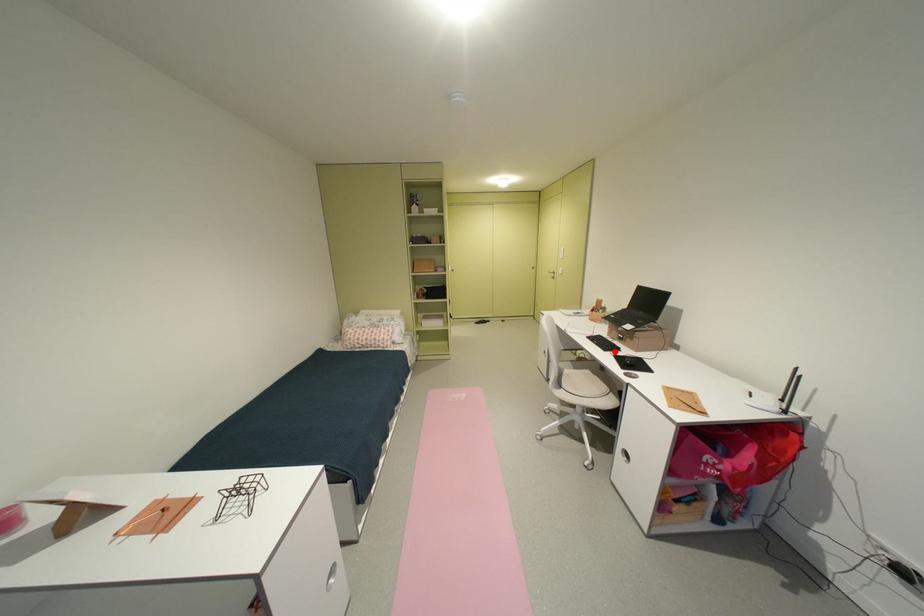
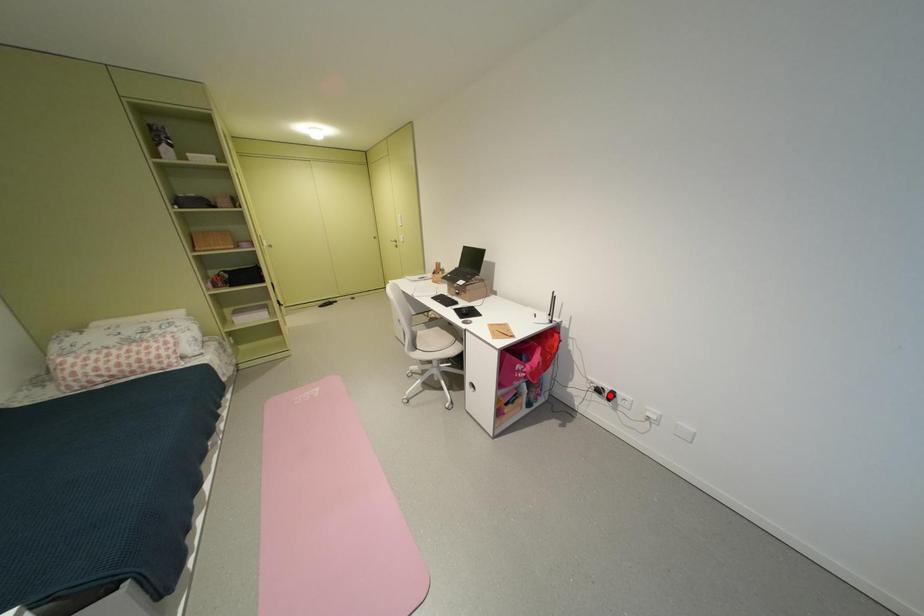
I am providing you with two images of the same scene from different viewpoints. A red point is marked on the first image and another point is marked on the second image. Is the marked point in image1 the same physical position as the marked point in image2?

No